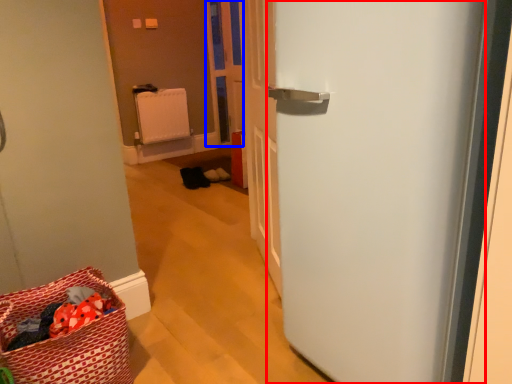
Question: Which of the following is the closest to the observer, door (highlighted by a red box) or screen door (highlighted by a blue box)?

Choices:
 (A) door
 (B) screen door

Answer: (A)